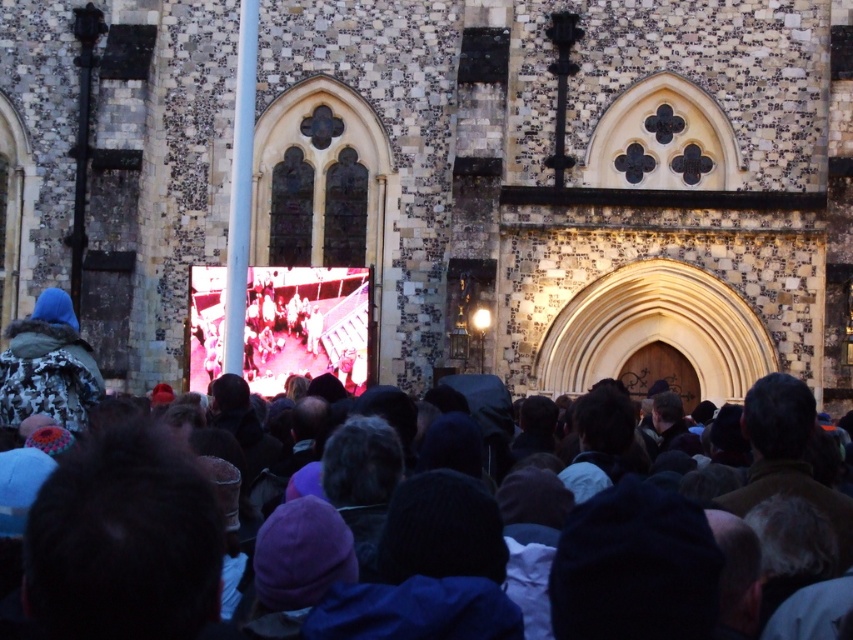
Does point (415, 150) lie in front of point (39, 355)?

No, (415, 150) is further to viewer.

Does point (445, 176) lie behind point (59, 358)?

Yes, point (445, 176) is farther from viewer.

Between point (514, 22) and point (67, 316), which one is positioned behind?

Positioned behind is point (514, 22).

Locate an element on the screen. The height and width of the screenshot is (640, 853). stone textured church at center is located at coordinates (439, 188).

Can you confirm if stone textured church at center is positioned below dark gray knit hats at center?

No.

Measure the distance from stone textured church at center to dark gray knit hats at center.

stone textured church at center and dark gray knit hats at center are 26.64 meters apart from each other.

What do you see at coordinates (439, 188) in the screenshot? I see `stone textured church at center` at bounding box center [439, 188].

Locate an element on the screen. This screenshot has height=640, width=853. stone textured church at center is located at coordinates (439, 188).

Who is higher up, dark gray knit hats at center or camouflage jacket at left?

camouflage jacket at left is above.

In the scene shown: Which is more to the right, dark gray knit hats at center or camouflage jacket at left?

Positioned to the right is dark gray knit hats at center.

Describe the element at coordinates (635, 566) in the screenshot. I see `dark gray knit hats at center` at that location.

Image resolution: width=853 pixels, height=640 pixels. In order to click on dark gray knit hats at center in this screenshot , I will do `click(635, 566)`.